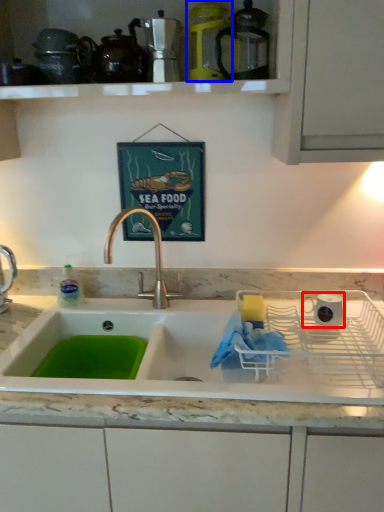
Question: Which of the following is the closest to the observer, appliance (highlighted by a red box) or appliance (highlighted by a blue box)?

Choices:
 (A) appliance
 (B) appliance

Answer: (B)